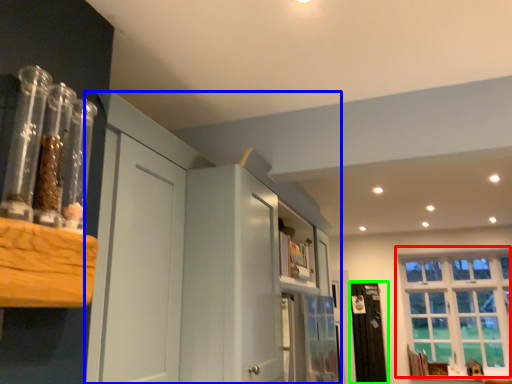
Question: Which object is the closest to the window (highlighted by a red box)? Choose among these: dresser (highlighted by a blue box) or screen door (highlighted by a green box).

Choices:
 (A) dresser
 (B) screen door

Answer: (B)